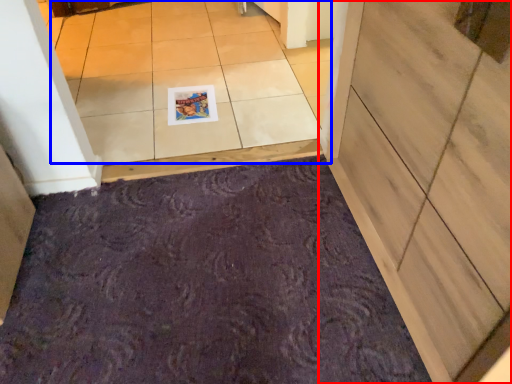
Question: Which of the following is the farthest to the observer, door (highlighted by a red box) or tile (highlighted by a blue box)?

Choices:
 (A) door
 (B) tile

Answer: (B)